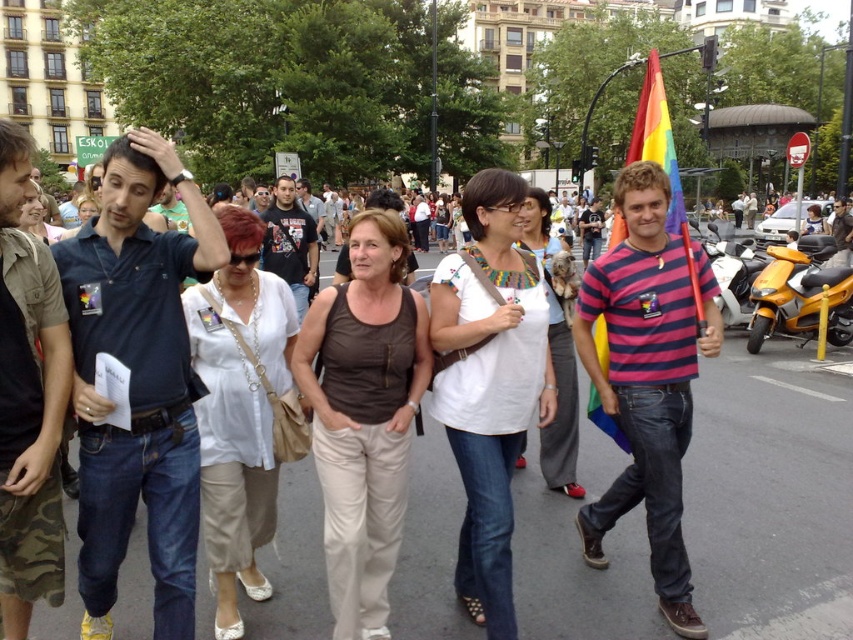
You are a fashion designer observing the crowd and want to create a new collection. Which of the two items, the brown fabric tank top at center or the white fabric dress at center, would you choose to feature in a design that emphasizes volume and fullness?

The brown fabric tank top at center has a larger size compared to the white fabric dress at center, so it would be the better choice to emphasize volume and fullness in the design.